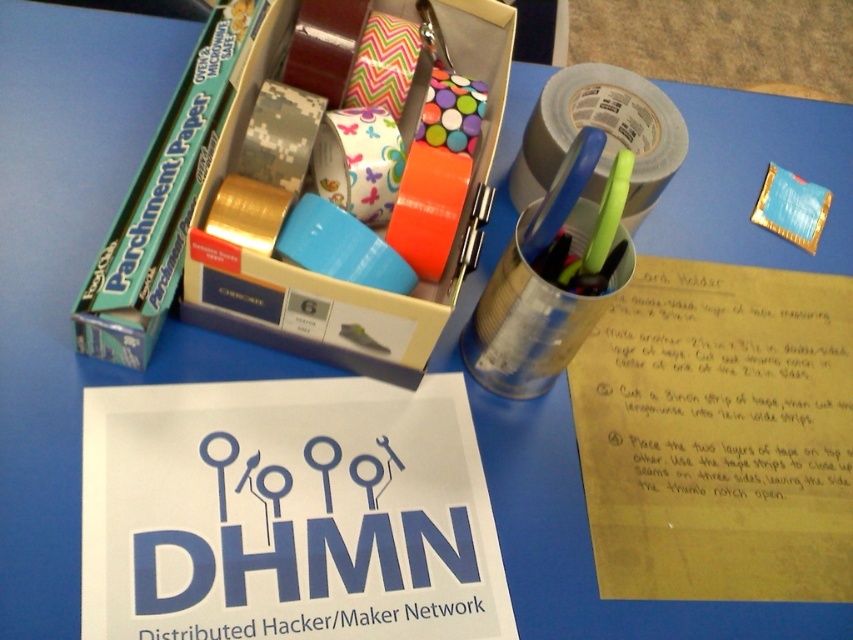
Is matte cardboard box at center above blue foil wrapper at upper right?

Correct, matte cardboard box at center is located above blue foil wrapper at upper right.

Is matte cardboard box at center bigger than blue foil wrapper at upper right?

Indeed, matte cardboard box at center has a larger size compared to blue foil wrapper at upper right.

The width and height of the screenshot is (853, 640). Describe the element at coordinates (318, 188) in the screenshot. I see `matte cardboard box at center` at that location.

The image size is (853, 640). I want to click on matte cardboard box at center, so click(318, 188).

Between point (469, 3) and point (489, 285), which one is positioned in front?

Point (489, 285) is more forward.

Does point (438, 240) lie in front of point (490, 310)?

Yes, point (438, 240) is in front of point (490, 310).

Measure the distance between point (212,228) and camera.

The distance of point (212,228) from camera is 22.00 inches.

Locate an element on the screen. The image size is (853, 640). matte cardboard box at center is located at coordinates (318, 188).

Which is behind, point (509, 317) or point (666, 147)?

Point (666, 147)

Can you confirm if metallic tin canister at center-right is taller than silver metallic tape at upper center?

Correct, metallic tin canister at center-right is much taller as silver metallic tape at upper center.

Find the location of `metallic tin canister at center-right`. metallic tin canister at center-right is located at coordinates (552, 276).